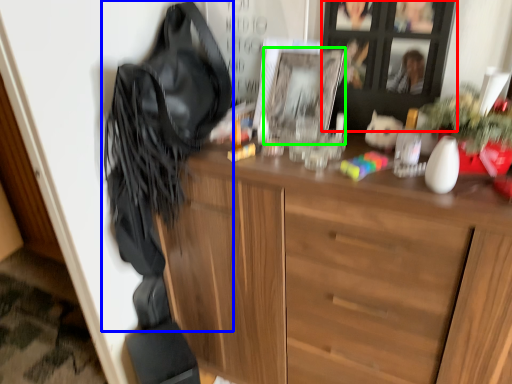
Question: Based on their relative distances, which object is nearer to cabinetry (highlighted by a red box)? Choose from shoulder bag (highlighted by a blue box) and picture frame (highlighted by a green box).

Choices:
 (A) shoulder bag
 (B) picture frame

Answer: (B)